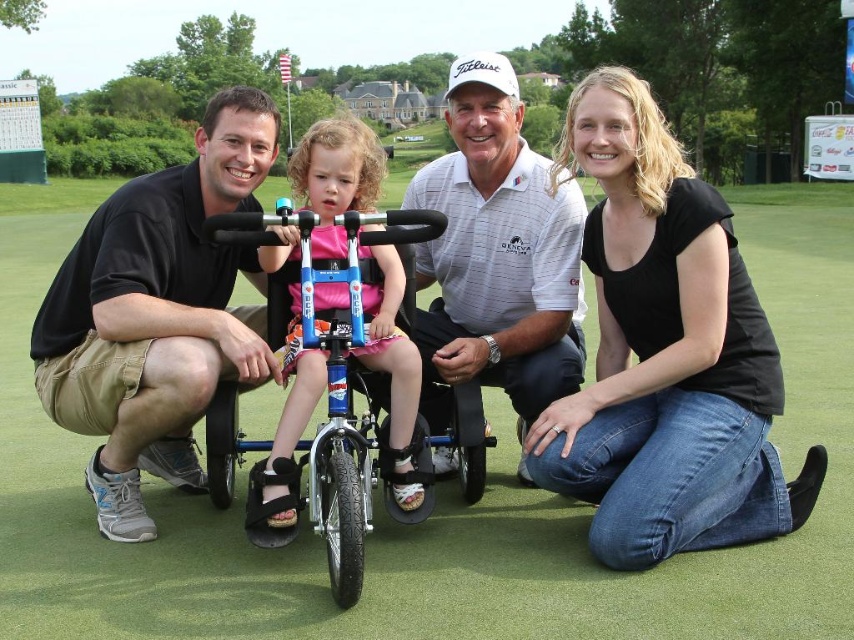
Does white textured polo shirt at center have a lesser width compared to blue metallic wheelchair at center?

In fact, white textured polo shirt at center might be wider than blue metallic wheelchair at center.

Who is positioned more to the left, white textured polo shirt at center or blue metallic wheelchair at center?

From the viewer's perspective, blue metallic wheelchair at center appears more on the left side.

This screenshot has width=854, height=640. Describe the element at coordinates (499, 250) in the screenshot. I see `white textured polo shirt at center` at that location.

Find the location of a particular element. The height and width of the screenshot is (640, 854). white textured polo shirt at center is located at coordinates (499, 250).

Is black cotton shirt at left further to camera compared to white textured polo shirt at center?

Yes, it is behind white textured polo shirt at center.

Is point (98, 268) closer to camera compared to point (535, 356)?

That is True.

In order to click on black cotton shirt at left in this screenshot , I will do `click(156, 314)`.

Which is more to the left, white textured polo shirt at center or pink fabric shirt at center?

From the viewer's perspective, pink fabric shirt at center appears more on the left side.

Image resolution: width=854 pixels, height=640 pixels. In order to click on white textured polo shirt at center in this screenshot , I will do `click(499, 250)`.

Identify the location of white textured polo shirt at center. (499, 250).